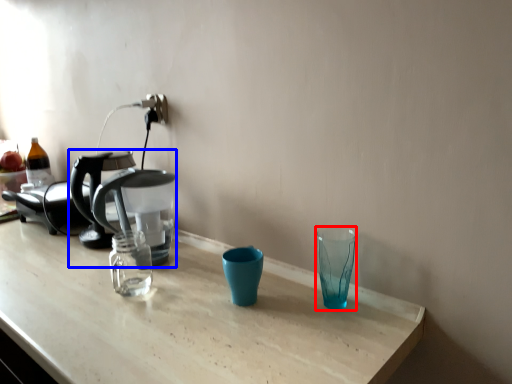
Question: Which object appears closest to the camera in this image, shot glass (highlighted by a red box) or coffee maker (highlighted by a blue box)?

Choices:
 (A) shot glass
 (B) coffee maker

Answer: (A)